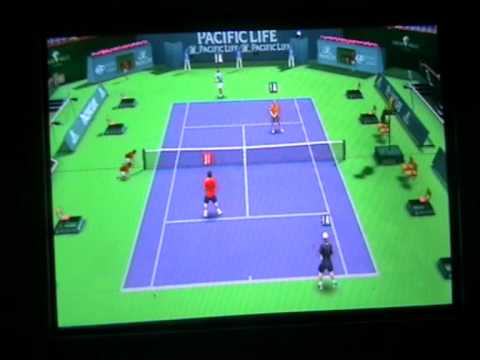
This screenshot has width=480, height=360. Find the location of `wall`. wall is located at coordinates (272, 45).